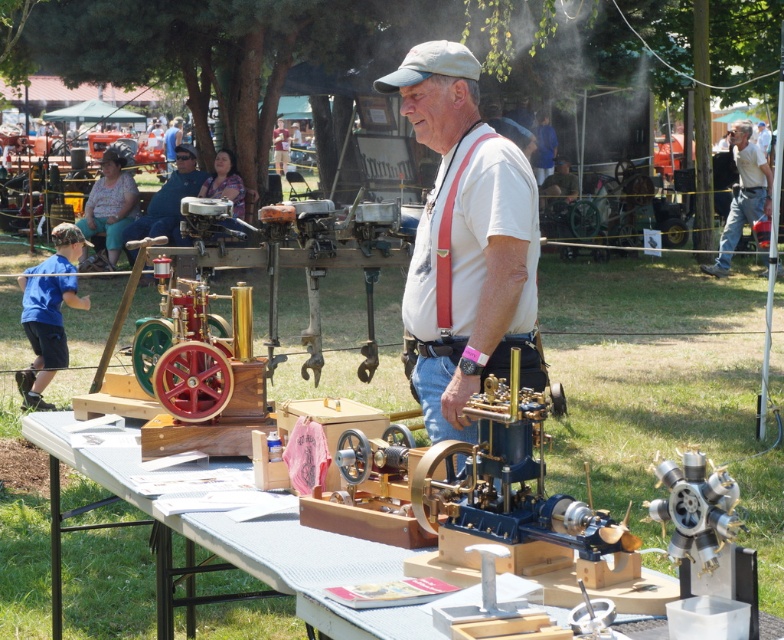
Does point (735, 189) come farther from viewer compared to point (492, 132)?

Yes.

Is point (737, 132) positioned in front of point (445, 228)?

No.

Is point (752, 168) in front of point (448, 212)?

That is False.

This screenshot has width=784, height=640. Find the location of `white shirt at upper right`. white shirt at upper right is located at coordinates (743, 195).

Between white cotton shirt at center and red fabric suspenders at center, which one appears on the right side from the viewer's perspective?

white cotton shirt at center

Is white cotton shirt at center taller than red fabric suspenders at center?

Yes.

You are a GUI agent. You are given a task and a screenshot of the screen. Output one action in this format:
    pyautogui.click(x=<x>, y=<y>)
    Task: Click on the white cotton shirt at center
    
    Given the screenshot: What is the action you would take?
    pyautogui.click(x=465, y=241)

Which of these two, white cotton shirt at center or white shirt at upper right, stands shorter?

With less height is white cotton shirt at center.

Can you confirm if white cotton shirt at center is positioned above white shirt at upper right?

No, white cotton shirt at center is not above white shirt at upper right.

Which is behind, point (434, 397) or point (757, 157)?

Positioned behind is point (757, 157).

At what (x,y) coordinates should I click in order to perform the action: click on white cotton shirt at center. Please return your answer as a coordinate pair (x, y). The height and width of the screenshot is (640, 784). Looking at the image, I should click on (465, 241).